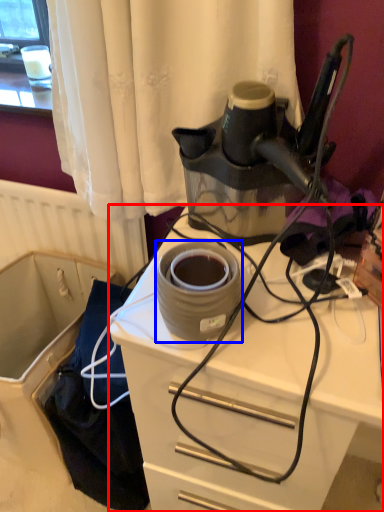
Question: Which point is further to the camera, desk (highlighted by a red box) or appliance (highlighted by a blue box)?

Choices:
 (A) desk
 (B) appliance

Answer: (B)